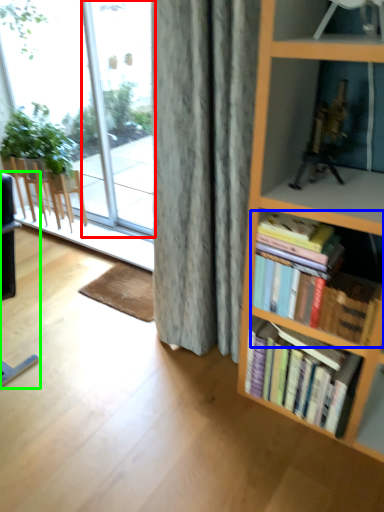
Question: Estimate the real-world distances between objects in this image. Which object is farther from glass door (highlighted by a red box), book (highlighted by a blue box) or chair (highlighted by a green box)?

Choices:
 (A) book
 (B) chair

Answer: (A)